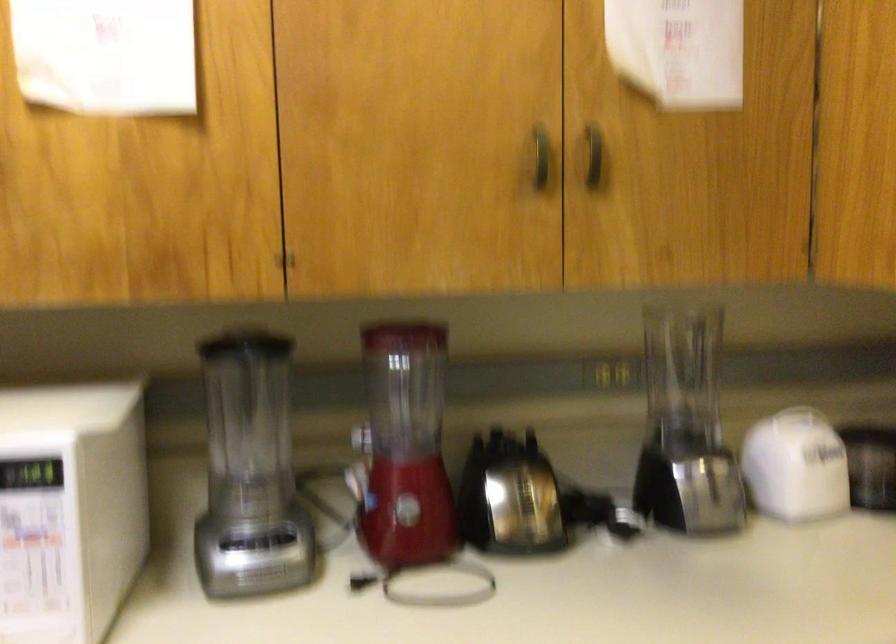
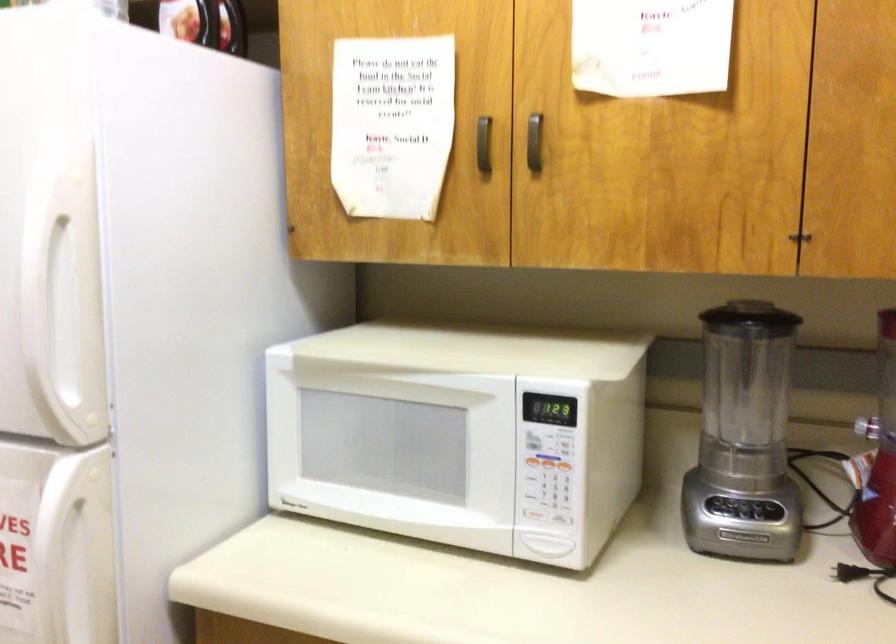
Locate, in the second image, the point that corresponds to the point at 286,540 in the first image.

(771, 509)